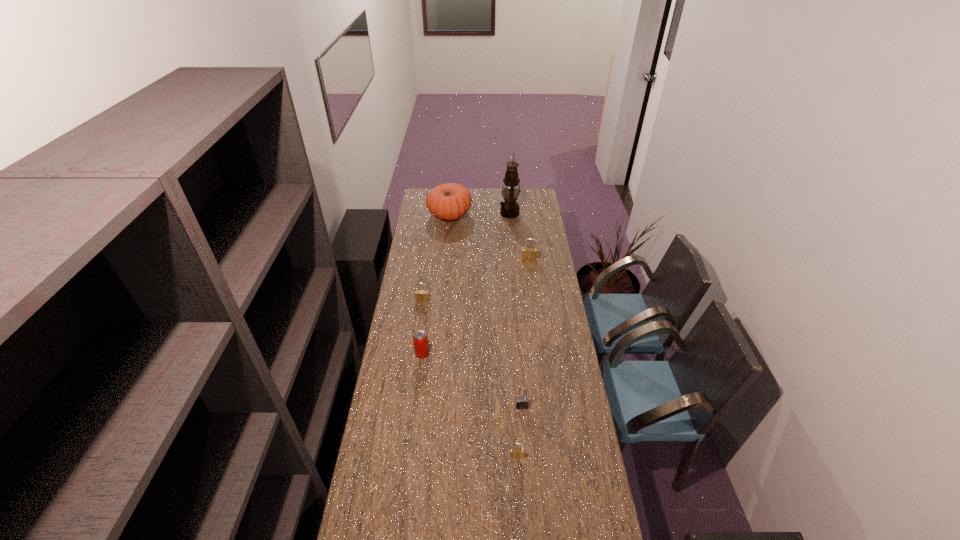
Where is `free space located on the front-facing side of the second brass padlock from left to right`? This screenshot has width=960, height=540. free space located on the front-facing side of the second brass padlock from left to right is located at coordinates (519, 489).

At what (x,y) coordinates should I click in order to perform the action: click on oil lamp present at the far edge. Please return your answer as a coordinate pair (x, y). The width and height of the screenshot is (960, 540). Looking at the image, I should click on (509, 208).

Locate an element on the screen. This screenshot has height=540, width=960. pumpkin that is at the far edge is located at coordinates (450, 201).

Locate an element on the screen. The width and height of the screenshot is (960, 540). pumpkin that is positioned at the left edge is located at coordinates (450, 201).

At what (x,y) coordinates should I click in order to perform the action: click on beer can present at the left edge. Please return your answer as a coordinate pair (x, y). This screenshot has width=960, height=540. Looking at the image, I should click on (421, 347).

Locate an element on the screen. The image size is (960, 540). padlock located in the left edge section of the desktop is located at coordinates (421, 295).

Locate an element on the screen. The width and height of the screenshot is (960, 540). oil lamp located at the right edge is located at coordinates (509, 208).

Locate an element on the screen. The height and width of the screenshot is (540, 960). padlock that is at the right edge is located at coordinates (528, 254).

Locate an element on the screen. object that is at the far left corner is located at coordinates (450, 201).

This screenshot has height=540, width=960. What are the coordinates of `object located at the far right corner` in the screenshot? It's located at (509, 208).